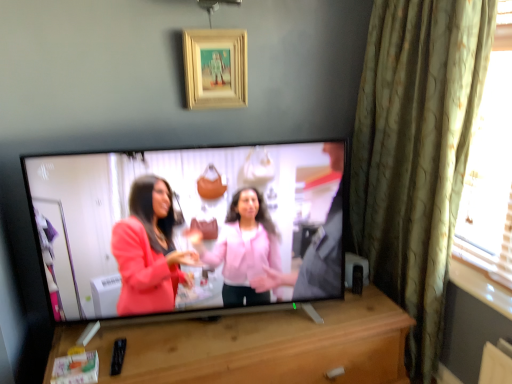
The width and height of the screenshot is (512, 384). I want to click on vacant location below matte black tv at center (from a real-world perspective), so [x=228, y=327].